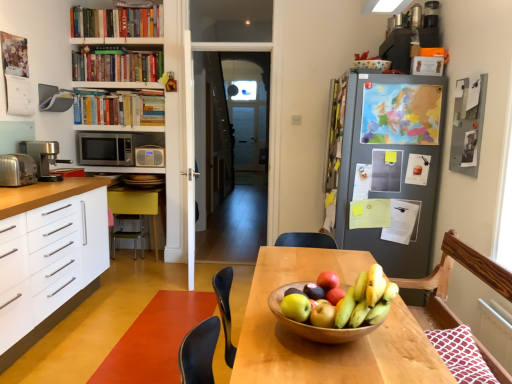
Question: Is silver metallic radio at center, the 1th appliance when ordered from back to front, wider than satin silver toaster at left, the 1th appliance positioned from the left?

Choices:
 (A) no
 (B) yes

Answer: (A)

Question: Can you confirm if silver metallic radio at center, the second appliance viewed from the front, is positioned to the left of satin silver toaster at left, which is the first appliance in front-to-back order?

Choices:
 (A) yes
 (B) no

Answer: (B)

Question: From a real-world perspective, is silver metallic radio at center, arranged as the 2th appliance when viewed from the left, positioned under satin silver toaster at left, the 2th appliance in the right-to-left sequence, based on gravity?

Choices:
 (A) no
 (B) yes

Answer: (A)

Question: From a real-world perspective, is silver metallic radio at center, which is the first appliance in right-to-left order, located higher than satin silver toaster at left, arranged as the second appliance when viewed from the back?

Choices:
 (A) yes
 (B) no

Answer: (A)

Question: Can you confirm if silver metallic radio at center, acting as the second appliance starting from the bottom, is smaller than satin silver toaster at left, the 1th appliance positioned from the left?

Choices:
 (A) no
 (B) yes

Answer: (B)

Question: From the image's perspective, is silver metallic radio at center, arranged as the first appliance when viewed from the top, on top of satin silver toaster at left, the 2th appliance in the right-to-left sequence?

Choices:
 (A) no
 (B) yes

Answer: (B)

Question: From a real-world perspective, is satin silver microwave at left physically above wooden chair at right, which appears as the 3th chair when viewed from the left?

Choices:
 (A) no
 (B) yes

Answer: (B)

Question: Does satin silver microwave at left have a greater width compared to wooden chair at right, which appears as the 3th chair when viewed from the left?

Choices:
 (A) no
 (B) yes

Answer: (B)

Question: Is satin silver microwave at left facing towards wooden chair at right, acting as the 1th chair starting from the front?

Choices:
 (A) no
 (B) yes

Answer: (A)

Question: Does satin silver microwave at left have a larger size compared to wooden chair at right, positioned as the 1th chair in right-to-left order?

Choices:
 (A) no
 (B) yes

Answer: (A)

Question: From a real-world perspective, is satin silver microwave at left beneath wooden chair at right, acting as the 1th chair starting from the front?

Choices:
 (A) no
 (B) yes

Answer: (A)

Question: Does satin silver microwave at left lie behind wooden chair at right, arranged as the third chair when viewed from the back?

Choices:
 (A) yes
 (B) no

Answer: (A)

Question: Does hardcover books at upper left, which is the 2th book in bottom-to-top order, turn towards green matte apple at center, which is the 2th apple in front-to-back order?

Choices:
 (A) no
 (B) yes

Answer: (A)